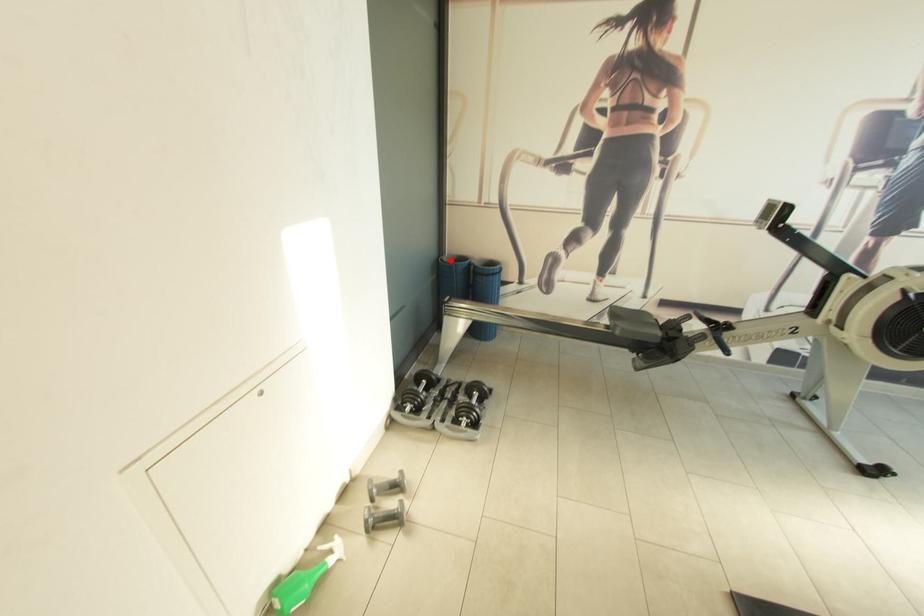
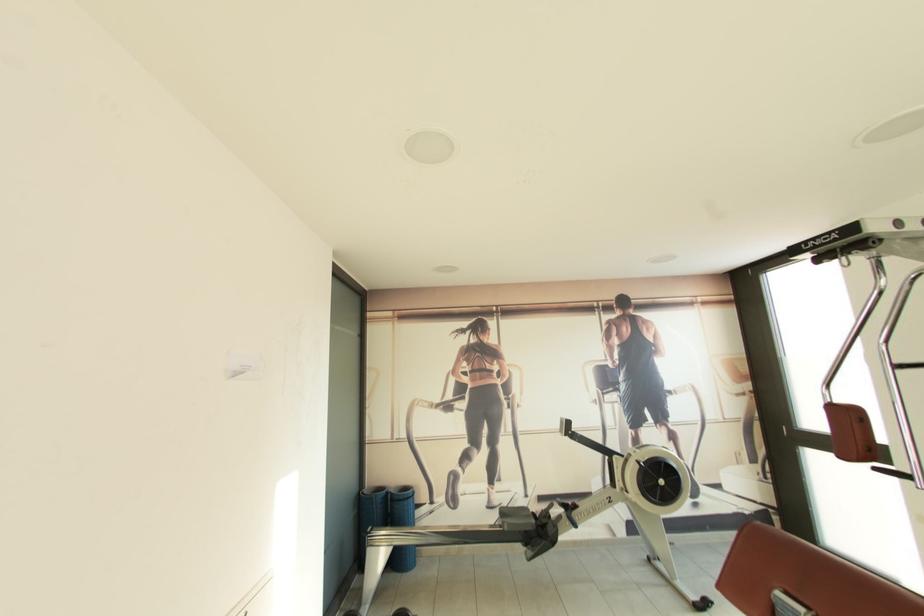
In the second image, find the point that corresponds to the highlighted location in the first image.

(371, 493)